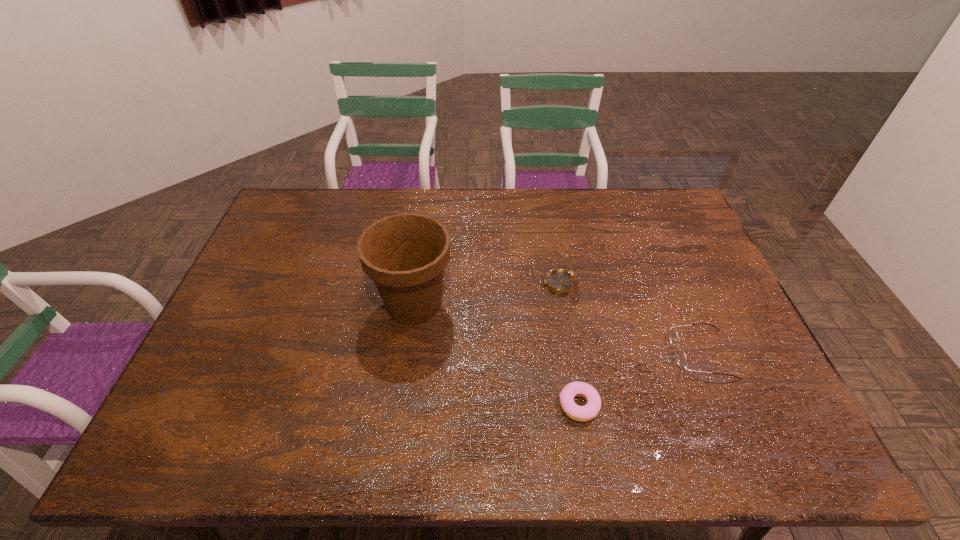
Find the location of `vacant space located with the dial facing the compass`. vacant space located with the dial facing the compass is located at coordinates (464, 284).

In order to click on blank area located through the lenses of the spectacles in this screenshot , I will do `click(639, 354)`.

The height and width of the screenshot is (540, 960). Find the location of `vacant space located through the lenses of the spectacles`. vacant space located through the lenses of the spectacles is located at coordinates (544, 354).

The height and width of the screenshot is (540, 960). I want to click on vacant space situated 0.070m through the lenses of the spectacles, so click(x=647, y=354).

The height and width of the screenshot is (540, 960). I want to click on free space located 0.360m on the right of the shortest object, so click(749, 405).

At what (x,y) coordinates should I click in order to perform the action: click on object at the near edge. Please return your answer as a coordinate pair (x, y). The height and width of the screenshot is (540, 960). Looking at the image, I should click on (585, 413).

Locate an element on the screen. The image size is (960, 540). object that is at the right edge is located at coordinates (681, 356).

This screenshot has width=960, height=540. In the image, there is a desktop. What are the coordinates of `free space at the far edge` in the screenshot? It's located at (488, 228).

Locate an element on the screen. Image resolution: width=960 pixels, height=540 pixels. vacant space at the near edge of the desktop is located at coordinates (726, 463).

Image resolution: width=960 pixels, height=540 pixels. Identify the location of vacant space at the left edge of the desktop. (241, 399).